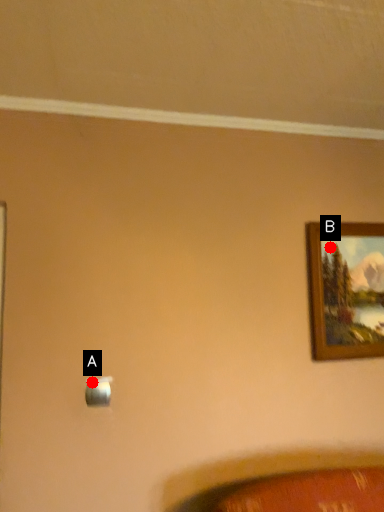
Question: Two points are circled on the image, labeled by A and B beside each circle. Among these points, which one is nearest to the camera?

Choices:
 (A) A is closer
 (B) B is closer

Answer: (A)